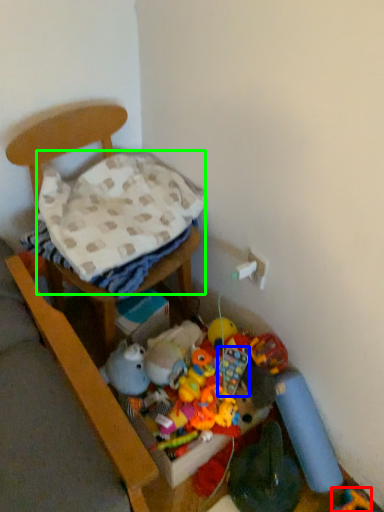
Question: Considering the real-world distances, which object is farthest from toy (highlighted by a red box)? toy (highlighted by a blue box) or blanket (highlighted by a green box)?

Choices:
 (A) toy
 (B) blanket

Answer: (B)